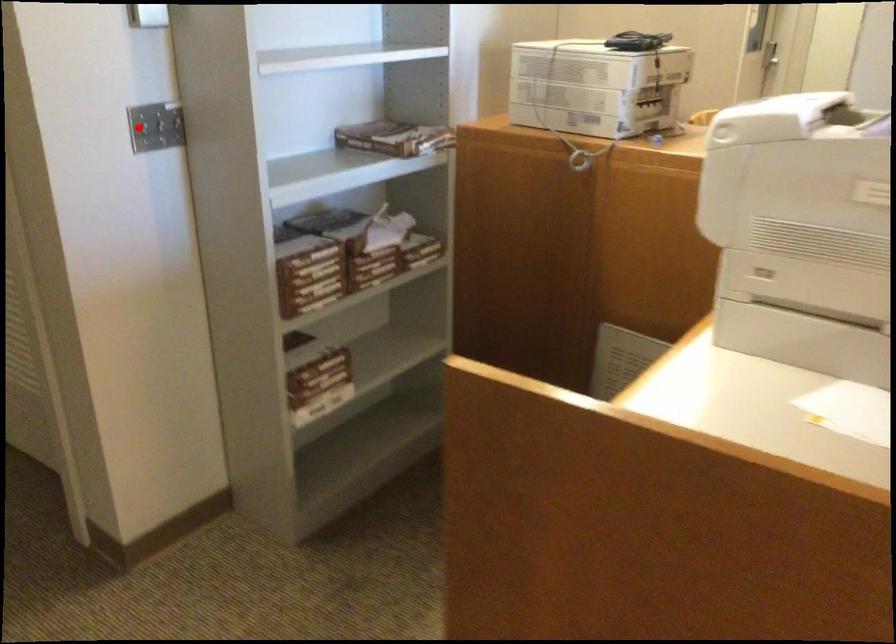
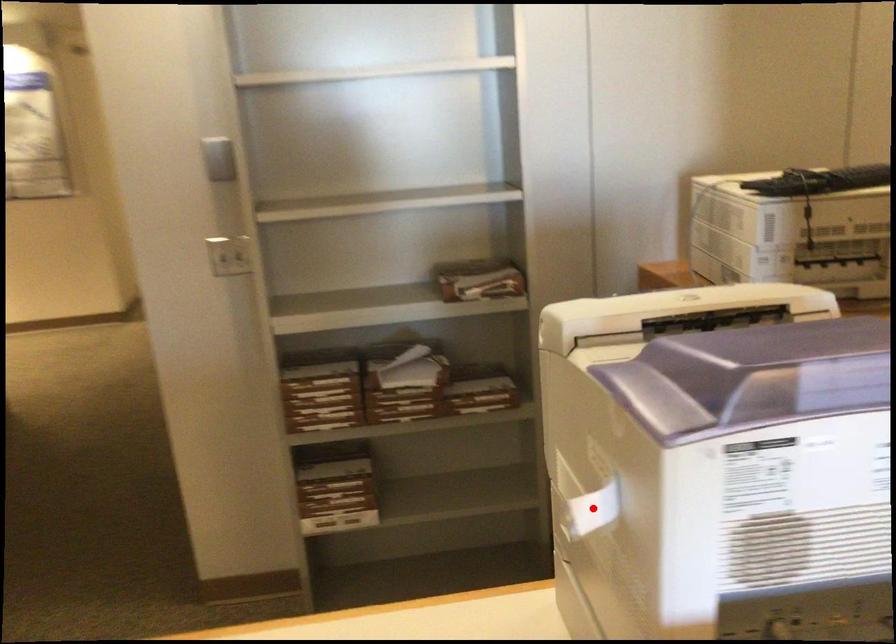
I am providing you with two images of the same scene from different viewpoints. A red point is marked on the first image and another point is marked on the second image. Is the red point in image1 aligned with the point shown in image2?

No